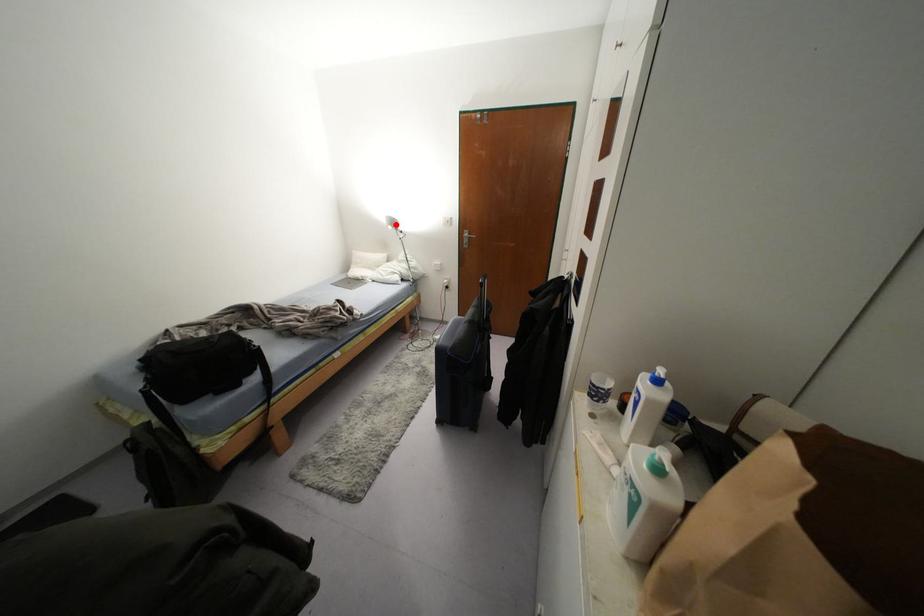
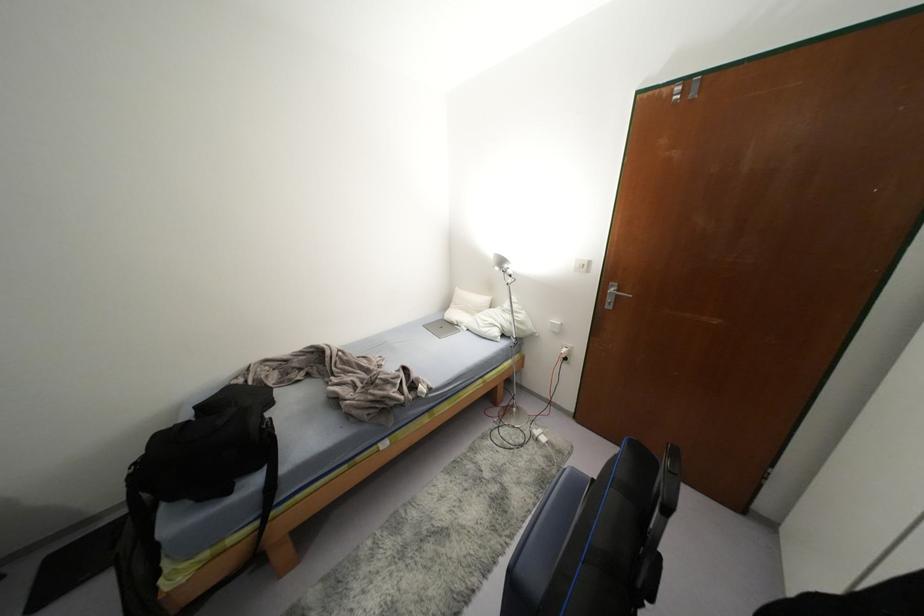
Where in the second image is the point corresponding to the highlighted location from the first image?

(505, 265)